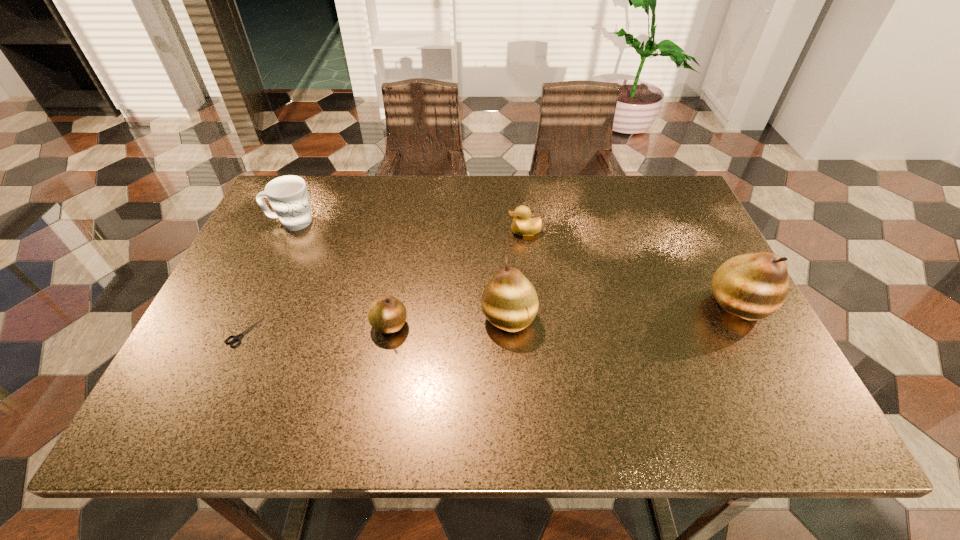
This screenshot has height=540, width=960. Find the location of `free space between the mug and the leftmost pear`. free space between the mug and the leftmost pear is located at coordinates (341, 274).

This screenshot has height=540, width=960. Identify the location of free space between the second shortest object and the shears. (385, 282).

Find the location of `free spot between the leftmost pear and the second pear from left to right`. free spot between the leftmost pear and the second pear from left to right is located at coordinates (449, 322).

You are a GUI agent. You are given a task and a screenshot of the screen. Output one action in this format:
    pyautogui.click(x=<x>, y=<y>)
    Task: Click on the vacant point located between the rightmost object and the mug
    
    Given the screenshot: What is the action you would take?
    pyautogui.click(x=515, y=264)

You are a GUI agent. You are given a task and a screenshot of the screen. Output one action in this format:
    pyautogui.click(x=<x>, y=<y>)
    Task: Click on the vacant space that is in between the duckling and the shortest object
    The width and height of the screenshot is (960, 540).
    Given the screenshot: What is the action you would take?
    pyautogui.click(x=385, y=282)

Find the location of a particular element. object that is the fifth nearest to the rightmost object is located at coordinates (235, 338).

In order to click on object that is the third closest to the second shortest object in this screenshot , I will do `click(753, 286)`.

Identify the location of the second closest pear to the mug. This screenshot has height=540, width=960. coord(509,301).

Image resolution: width=960 pixels, height=540 pixels. Find the location of `pear that is the second closest to the shortest object`. pear that is the second closest to the shortest object is located at coordinates (509, 301).

Where is `vacant region that satisfies the following two spatial constraints: 1. facing forward on the duckling; 2. on the left side of the rightmost object`? The height and width of the screenshot is (540, 960). vacant region that satisfies the following two spatial constraints: 1. facing forward on the duckling; 2. on the left side of the rightmost object is located at coordinates pyautogui.click(x=533, y=305).